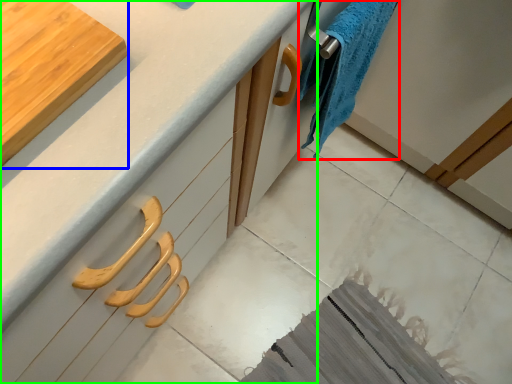
Question: Estimate the real-world distances between objects in this image. Which object is closer to bath towel (highlighted by a red box), cutting board (highlighted by a blue box) or countertop (highlighted by a green box)?

Choices:
 (A) cutting board
 (B) countertop

Answer: (B)